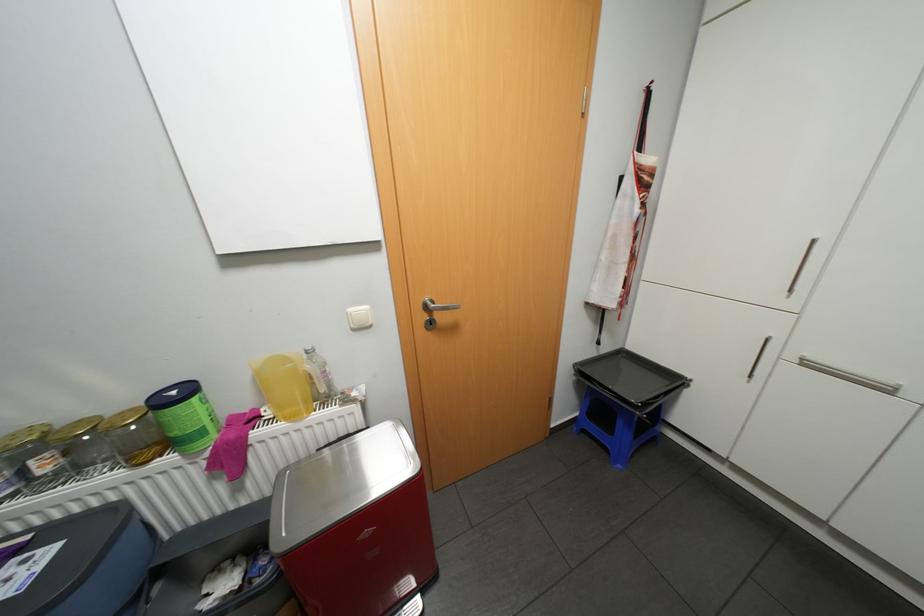
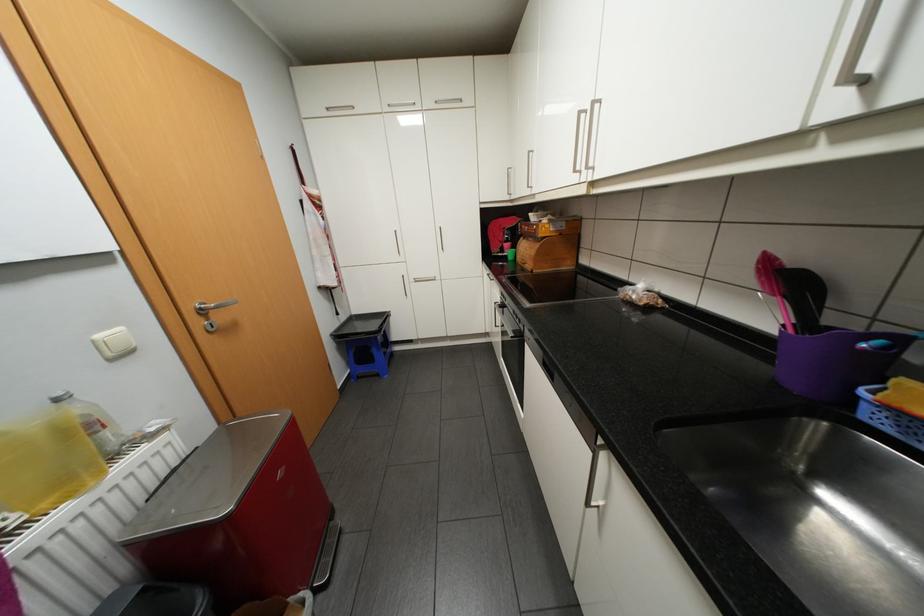
Where in the second image is the point corresponding to pixel 314 350 from the first image?

(65, 399)